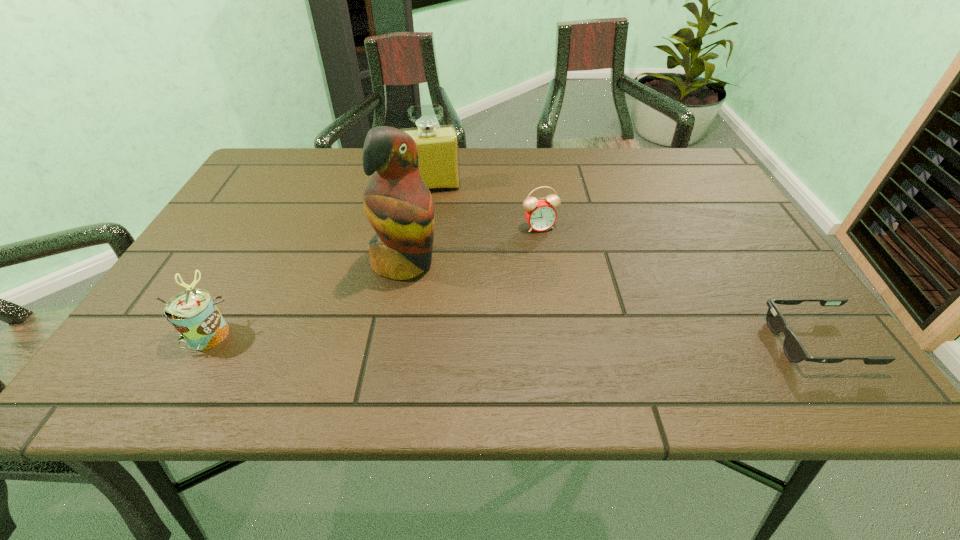
Image resolution: width=960 pixels, height=540 pixels. I want to click on vacant space located on the right of the leftmost object, so click(336, 334).

At what (x,y) coordinates should I click in order to perform the action: click on vacant space located on the temples of the rightmost object. Please return your answer as a coordinate pair (x, y). Looking at the image, I should click on (706, 341).

Locate an element on the screen. The width and height of the screenshot is (960, 540). vacant region located on the temples of the rightmost object is located at coordinates (689, 341).

Where is `free space located 0.330m on the temples of the rightmost object`? free space located 0.330m on the temples of the rightmost object is located at coordinates (600, 341).

Identify the location of free space located 0.390m on the front-facing side of the farthest object. This screenshot has width=960, height=540. (459, 301).

At what (x,y) coordinates should I click in order to perform the action: click on vacant area located on the front-facing side of the farthest object. Please return your answer as a coordinate pair (x, y). Looking at the image, I should click on (444, 230).

You are a GUI agent. You are given a task and a screenshot of the screen. Output one action in this format:
    pyautogui.click(x=<x>, y=<y>)
    Task: Click on the free space located on the front-facing side of the farthest object
    Image resolution: width=960 pixels, height=540 pixels.
    Given the screenshot: What is the action you would take?
    pyautogui.click(x=439, y=209)

This screenshot has height=540, width=960. I want to click on vacant space located 0.130m on the face of the third nearest object, so click(472, 307).

Locate an element on the screen. Image resolution: width=960 pixels, height=540 pixels. vacant region located on the face of the third nearest object is located at coordinates (522, 341).

I want to click on vacant area situated on the face of the third nearest object, so click(522, 341).